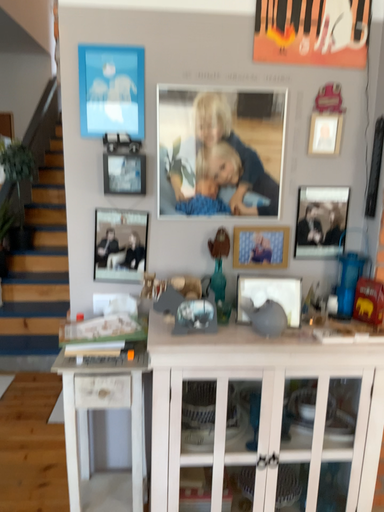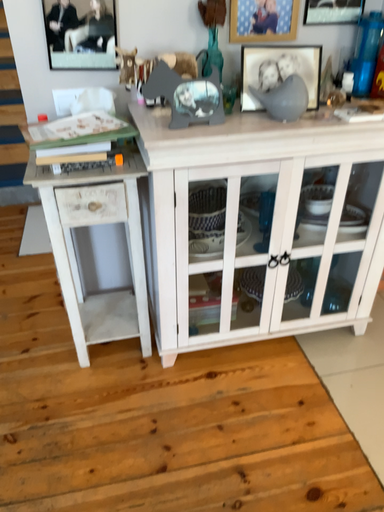
Question: How did the camera likely rotate when shooting the video?

Choices:
 (A) rotated upward
 (B) rotated downward

Answer: (B)